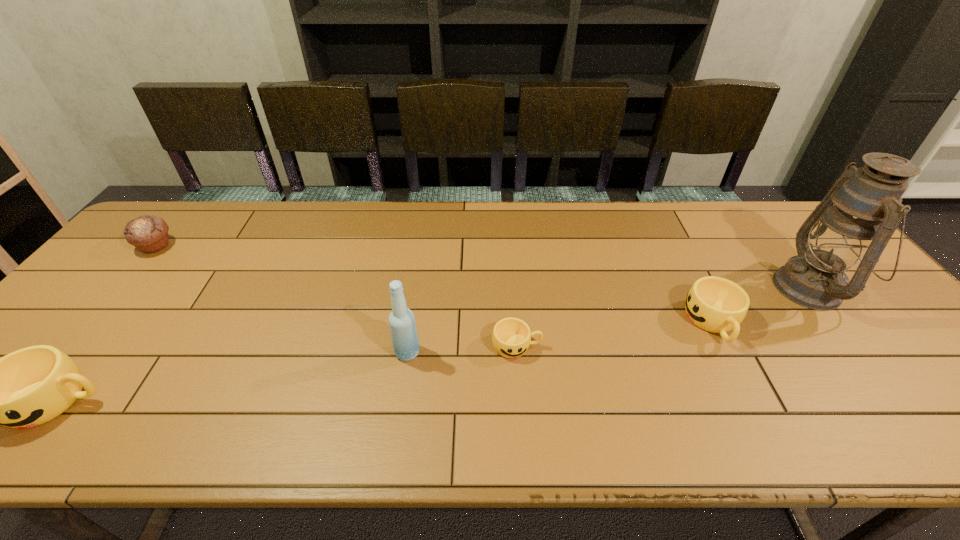
Where is `vacant space located on the back of the rightmost cup`? vacant space located on the back of the rightmost cup is located at coordinates (670, 239).

In order to click on vacant region located 0.300m on the back of the oil lamp in this screenshot , I will do `click(743, 201)`.

I want to click on vacant space positioned 0.070m on the right of the muffin, so click(x=197, y=246).

At what (x,y) coordinates should I click in order to perform the action: click on free region located 0.400m on the right of the fifth shortest object. Please return your answer as a coordinate pair (x, y). The width and height of the screenshot is (960, 540). Looking at the image, I should click on (588, 352).

This screenshot has width=960, height=540. Identify the location of object at the far edge. (148, 233).

Identify the location of object positioned at the left edge. The width and height of the screenshot is (960, 540). (148, 233).

Where is `object at the right edge`? object at the right edge is located at coordinates (858, 216).

At what (x,y) coordinates should I click in order to perform the action: click on object at the far left corner. Please return your answer as a coordinate pair (x, y). This screenshot has height=540, width=960. Looking at the image, I should click on (148, 233).

In the image, there is a desktop. In order to click on vacant space at the far edge in this screenshot , I will do `click(235, 202)`.

Locate an element on the screen. Image resolution: width=960 pixels, height=540 pixels. vacant position at the left edge of the desktop is located at coordinates (110, 319).